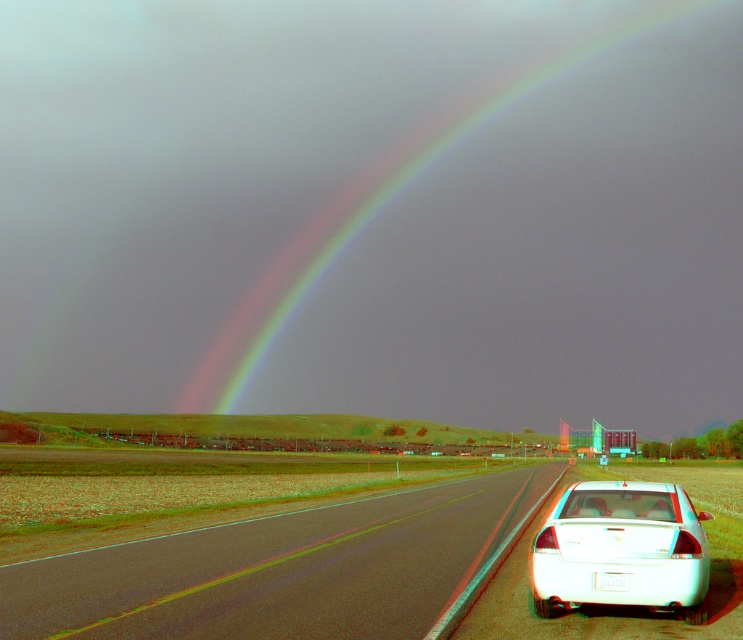
What do you see at coordinates (279, 570) in the screenshot?
I see `asphalt road at lower right` at bounding box center [279, 570].

Does asphalt road at lower right appear on the right side of white plastic license plate at lower right?

No, asphalt road at lower right is not to the right of white plastic license plate at lower right.

From the picture: Who is more distant from viewer, (487, 493) or (594, 577)?

The point (487, 493) is behind.

This screenshot has height=640, width=743. Identify the location of asphalt road at lower right. (279, 570).

What do you see at coordinates (279, 570) in the screenshot? I see `asphalt road at lower right` at bounding box center [279, 570].

Does point (137, 545) come farther from viewer compared to point (701, 563)?

Yes, it is behind point (701, 563).

Is point (146, 561) farther from viewer compared to point (559, 518)?

Yes, point (146, 561) is farther from viewer.

You are a GUI agent. You are given a task and a screenshot of the screen. Output one action in this format:
    pyautogui.click(x=<x>, y=<y>)
    Task: Click on the asphalt road at lower right
    The width and height of the screenshot is (743, 640).
    Given the screenshot: What is the action you would take?
    pyautogui.click(x=279, y=570)

Does point (655, 512) come behind point (623, 572)?

Yes, point (655, 512) is farther from viewer.

This screenshot has height=640, width=743. I want to click on white glossy sedan at lower right, so click(x=620, y=548).

Between point (637, 518) and point (600, 586), which one is positioned behind?

The point (637, 518) is more distant.

The width and height of the screenshot is (743, 640). What are the coordinates of `white glossy sedan at lower right` in the screenshot? It's located at (620, 548).